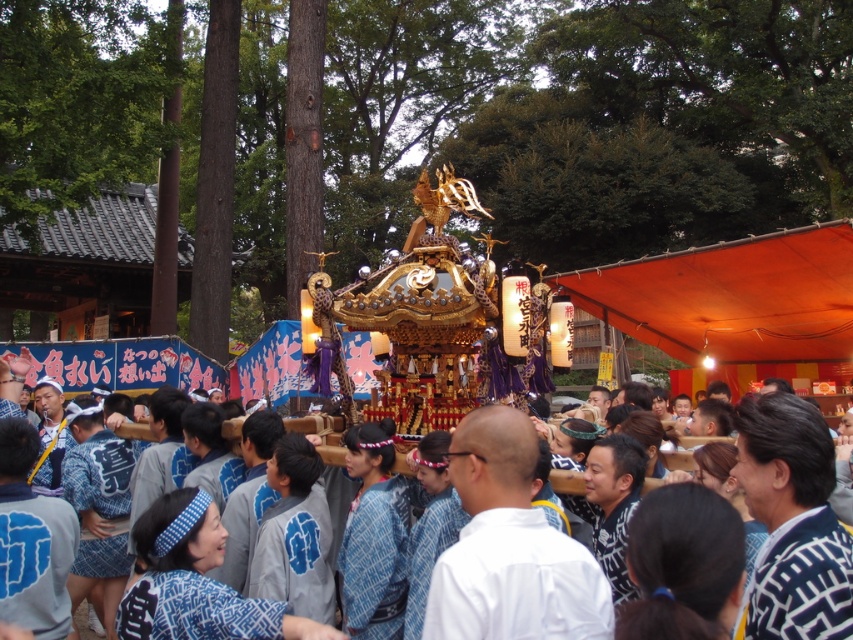
Question: Is white matte robe at center positioned at the back of knitted sweater at center?

Choices:
 (A) yes
 (B) no

Answer: (A)

Question: Observing the image, what is the correct spatial positioning of white matte robe at center in reference to blue patterned kimono at center?

Choices:
 (A) right
 (B) left

Answer: (A)

Question: Which point is farther to the camera?

Choices:
 (A) (782, 476)
 (B) (772, 563)
 (C) (482, 586)

Answer: (A)

Question: Which point is closer to the camera?

Choices:
 (A) (515, 513)
 (B) (775, 609)

Answer: (B)

Question: Does white matte robe at center lie in front of blue patterned kimono at center?

Choices:
 (A) no
 (B) yes

Answer: (B)

Question: Which object is farther from the camera taking this photo?

Choices:
 (A) white matte robe at center
 (B) blue patterned kimono at center
 (C) knitted sweater at center

Answer: (B)